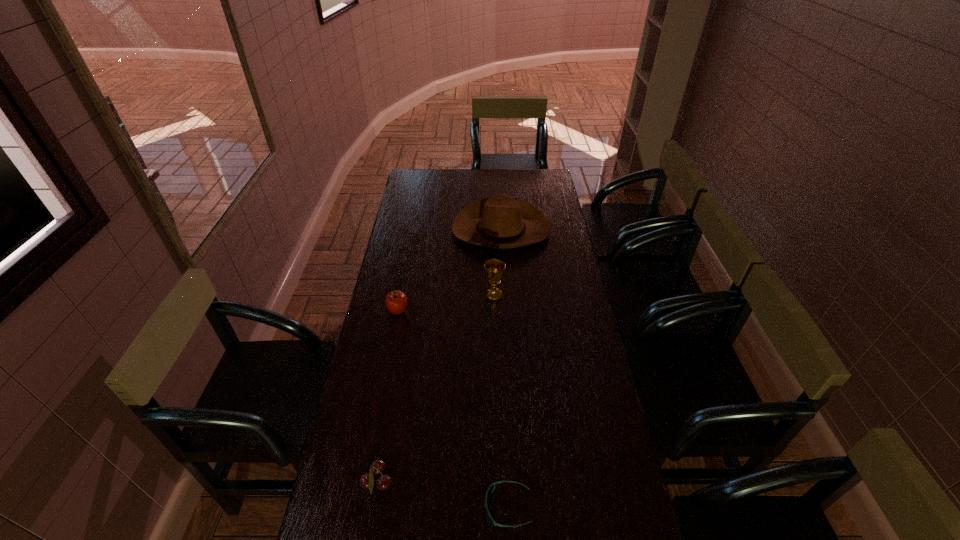
Identify the location of free space between the apple and the cowboy hat. (449, 271).

The image size is (960, 540). Identify the location of vacant space in between the apple and the farthest object. point(449,271).

You are a GUI agent. You are given a task and a screenshot of the screen. Output one action in this format:
    pyautogui.click(x=<x>, y=<y>)
    Task: Click on the free point between the cowboy hat and the sunglasses
    This screenshot has width=960, height=540.
    Given the screenshot: What is the action you would take?
    pyautogui.click(x=504, y=368)

This screenshot has height=540, width=960. Find the location of `free area in between the chalice and the cherry`. free area in between the chalice and the cherry is located at coordinates (436, 389).

Find the location of a particular element. This screenshot has width=960, height=540. empty location between the cherry and the farthest object is located at coordinates (440, 356).

I want to click on free space between the apple and the shortest object, so click(x=453, y=409).

Identify the location of free space that is in between the chalice and the cherry. (436, 389).

The height and width of the screenshot is (540, 960). Find the location of `free spot between the apple and the second shortest object`. free spot between the apple and the second shortest object is located at coordinates (388, 397).

Locate which object ranks second in proximity to the second farthest object. Please provide its 2D coordinates. Your answer should be formatted as a tuple, i.e. [(x, y)], where the tuple contains the x and y coordinates of a point satisfying the conditions above.

[(396, 301)]

Select which object appears as the third closest to the cherry. Please provide its 2D coordinates. Your answer should be formatted as a tuple, i.e. [(x, y)], where the tuple contains the x and y coordinates of a point satisfying the conditions above.

[(494, 269)]